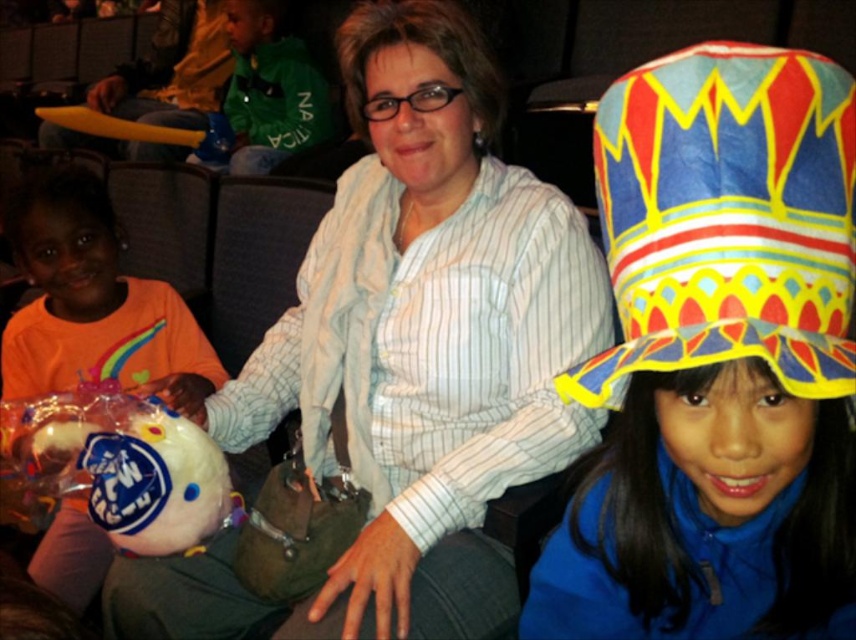
Question: Estimate the real-world distances between objects in this image. Which object is farther from the paper crown at upper right?

Choices:
 (A) orange fabric plush toy at left
 (B) white striped shirt at center

Answer: (A)

Question: Which point is closer to the camera taking this photo?

Choices:
 (A) (801, 269)
 (B) (64, 205)

Answer: (A)

Question: Does white striped shirt at center appear under orange fabric plush toy at left?

Choices:
 (A) yes
 (B) no

Answer: (A)

Question: Which is farther from the paper crown at upper right?

Choices:
 (A) white striped shirt at center
 (B) orange fabric plush toy at left

Answer: (B)

Question: Is white striped shirt at center thinner than orange fabric plush toy at left?

Choices:
 (A) no
 (B) yes

Answer: (A)

Question: Is white striped shirt at center to the right of paper crown at upper right from the viewer's perspective?

Choices:
 (A) yes
 (B) no

Answer: (B)